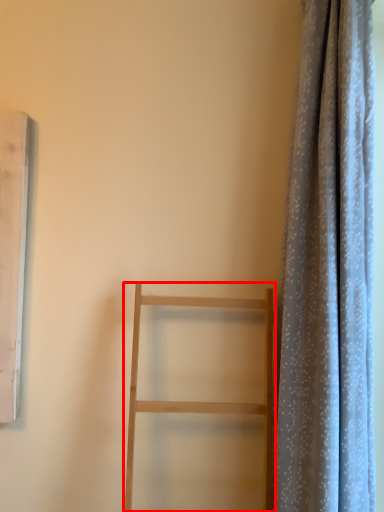
Question: From the image's perspective, what is the correct spatial relationship of furniture (annotated by the red box) in relation to curtain?

Choices:
 (A) above
 (B) below

Answer: (B)